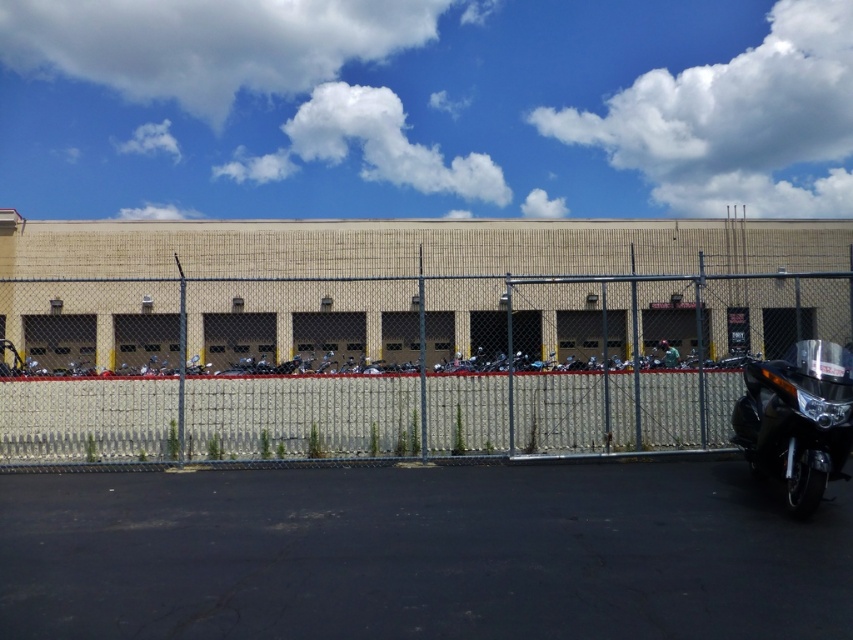
You are standing in front of the industrial building and want to take a photo of the two points marked in the scene. Which point, point (541, 540) or point (850, 445), will appear larger in your camera view?

Point (541, 540) will appear larger in the camera view because it is closer to the camera than point (850, 445).